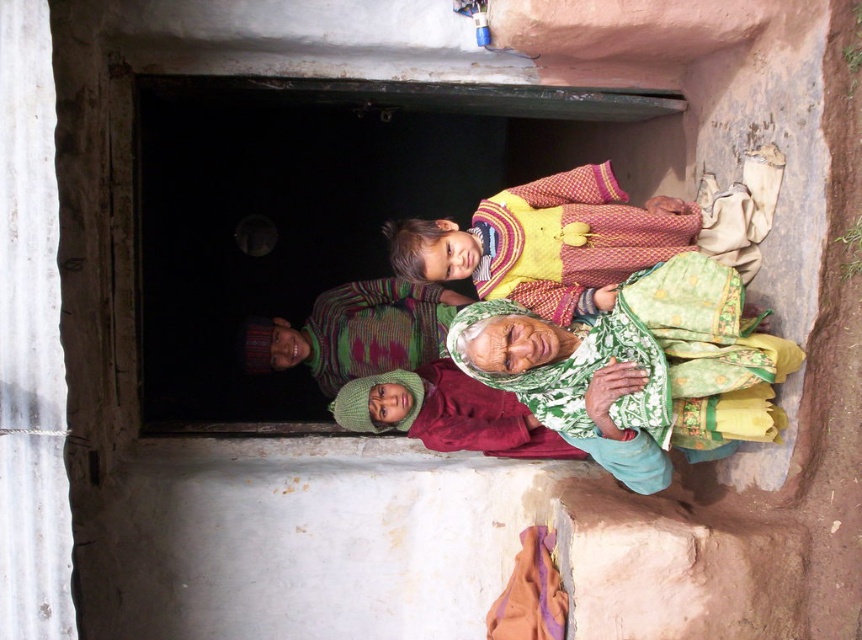
You are a tailor who needs to determine which item requires more fabric between the green knitted hat at lower center and the knitted sweater at center. Based on the scene, which one would need more fabric?

The green knitted hat at lower center is bigger than the knitted sweater at center, so it would require more fabric.

You are a fashion designer observing the clothing items in the scene. Which clothing item has a greater width between the green knitted hat at lower center and the knitted sweater at center?

The green knitted hat at lower center has a greater width than the knitted sweater at center.